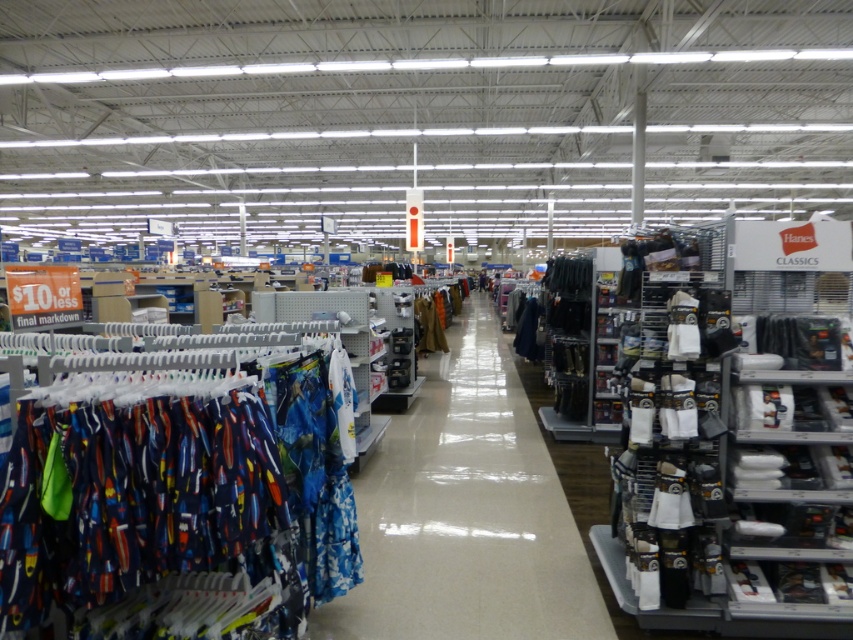
Question: Where is printed cotton shorts at left located in relation to brown leather jacket at center in the image?

Choices:
 (A) left
 (B) right

Answer: (A)

Question: Which of the following is the farthest from the observer?

Choices:
 (A) (422, 324)
 (B) (410, 552)
 (C) (334, 433)

Answer: (A)

Question: Is blue fabric shirts at center smaller than brown leather jacket at center?

Choices:
 (A) yes
 (B) no

Answer: (B)

Question: Which of the following is the farthest from the observer?

Choices:
 (A) printed cotton shorts at left
 (B) blue fabric shirts at center

Answer: (B)

Question: Is blue fabric shirts at center thinner than brown leather jacket at center?

Choices:
 (A) yes
 (B) no

Answer: (B)

Question: Which object appears farthest from the camera in this image?

Choices:
 (A) blue fabric shirts at center
 (B) brown leather jacket at center

Answer: (B)